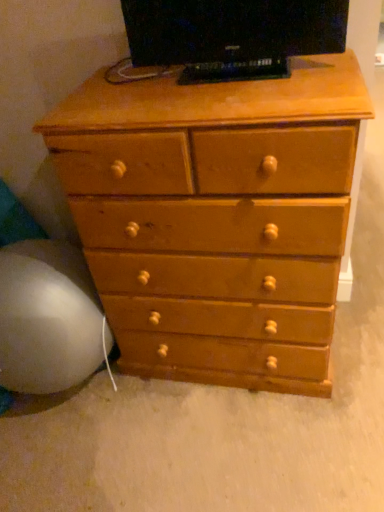
Identify the location of matte black tv at upper center. The height and width of the screenshot is (512, 384). (232, 35).

Locate an element on the screen. Image resolution: width=384 pixels, height=512 pixels. white fabric bean bag at lower left is located at coordinates (45, 308).

Identify the location of light brown wood chest of drawers at center. click(216, 205).

Find the location of a particular element. matte black tv at upper center is located at coordinates (232, 35).

Between matte black tv at upper center and white fabric bean bag at lower left, which one has smaller size?

Smaller between the two is matte black tv at upper center.

Looking at this image, which of these two, matte black tv at upper center or white fabric bean bag at lower left, is thinner?

With smaller width is matte black tv at upper center.

Which is more to the left, white fabric bean bag at lower left or light brown wood chest of drawers at center?

Positioned to the left is white fabric bean bag at lower left.

You are a GUI agent. You are given a task and a screenshot of the screen. Output one action in this format:
    pyautogui.click(x=<x>, y=<y>)
    Task: Click on the bean bag chair on the left side of light brown wood chest of drawers at center
    The image size is (384, 512).
    Given the screenshot: What is the action you would take?
    pyautogui.click(x=45, y=308)

From their relative heights in the image, would you say light brown wood chest of drawers at center is taller or shorter than white fabric bean bag at lower left?

light brown wood chest of drawers at center is taller than white fabric bean bag at lower left.

Between light brown wood chest of drawers at center and white fabric bean bag at lower left, which one has smaller size?

Smaller between the two is white fabric bean bag at lower left.

Is light brown wood chest of drawers at center outside of white fabric bean bag at lower left?

Absolutely, light brown wood chest of drawers at center is external to white fabric bean bag at lower left.

Does white fabric bean bag at lower left appear on the right side of matte black tv at upper center?

No, white fabric bean bag at lower left is not to the right of matte black tv at upper center.

From the image's perspective, is white fabric bean bag at lower left positioned above or below matte black tv at upper center?

white fabric bean bag at lower left is below matte black tv at upper center.

Which of these two, white fabric bean bag at lower left or matte black tv at upper center, is wider?

With larger width is white fabric bean bag at lower left.

Can you confirm if white fabric bean bag at lower left is smaller than matte black tv at upper center?

No, white fabric bean bag at lower left is not smaller than matte black tv at upper center.

Considering the sizes of objects matte black tv at upper center and light brown wood chest of drawers at center in the image provided, who is bigger, matte black tv at upper center or light brown wood chest of drawers at center?

Bigger between the two is light brown wood chest of drawers at center.

Find the location of `the chest of drawers in front of the matte black tv at upper center`. the chest of drawers in front of the matte black tv at upper center is located at coordinates (216, 205).

From the picture: Does matte black tv at upper center contain light brown wood chest of drawers at center?

No, light brown wood chest of drawers at center is located outside of matte black tv at upper center.

Is matte black tv at upper center shorter than light brown wood chest of drawers at center?

Yes.

From a real-world perspective, is light brown wood chest of drawers at center over matte black tv at upper center?

No.

Can you confirm if light brown wood chest of drawers at center is taller than matte black tv at upper center?

Indeed, light brown wood chest of drawers at center has a greater height compared to matte black tv at upper center.

Is matte black tv at upper center surrounded by light brown wood chest of drawers at center?

Definitely not — matte black tv at upper center is not inside light brown wood chest of drawers at center.

In order to click on television above the white fabric bean bag at lower left (from the image's perspective) in this screenshot , I will do pos(232,35).

Where is `chest of drawers lying on the right of white fabric bean bag at lower left`? chest of drawers lying on the right of white fabric bean bag at lower left is located at coordinates (216, 205).

Considering their positions, is white fabric bean bag at lower left positioned closer to matte black tv at upper center than light brown wood chest of drawers at center?

The object closer to matte black tv at upper center is light brown wood chest of drawers at center.

When comparing their distances from light brown wood chest of drawers at center, does matte black tv at upper center or white fabric bean bag at lower left seem closer?

matte black tv at upper center is positioned closer to the anchor light brown wood chest of drawers at center.

Which object lies further to the anchor point light brown wood chest of drawers at center, white fabric bean bag at lower left or matte black tv at upper center?

white fabric bean bag at lower left is positioned further to the anchor light brown wood chest of drawers at center.

Estimate the real-world distances between objects in this image. Which object is closer to white fabric bean bag at lower left, light brown wood chest of drawers at center or matte black tv at upper center?

light brown wood chest of drawers at center.

When comparing their distances from white fabric bean bag at lower left, does matte black tv at upper center or light brown wood chest of drawers at center seem further?

matte black tv at upper center.

From the image, which object appears to be farther from matte black tv at upper center, light brown wood chest of drawers at center or white fabric bean bag at lower left?

white fabric bean bag at lower left.

This screenshot has width=384, height=512. In order to click on chest of drawers between matte black tv at upper center and white fabric bean bag at lower left in the vertical direction in this screenshot , I will do `click(216, 205)`.